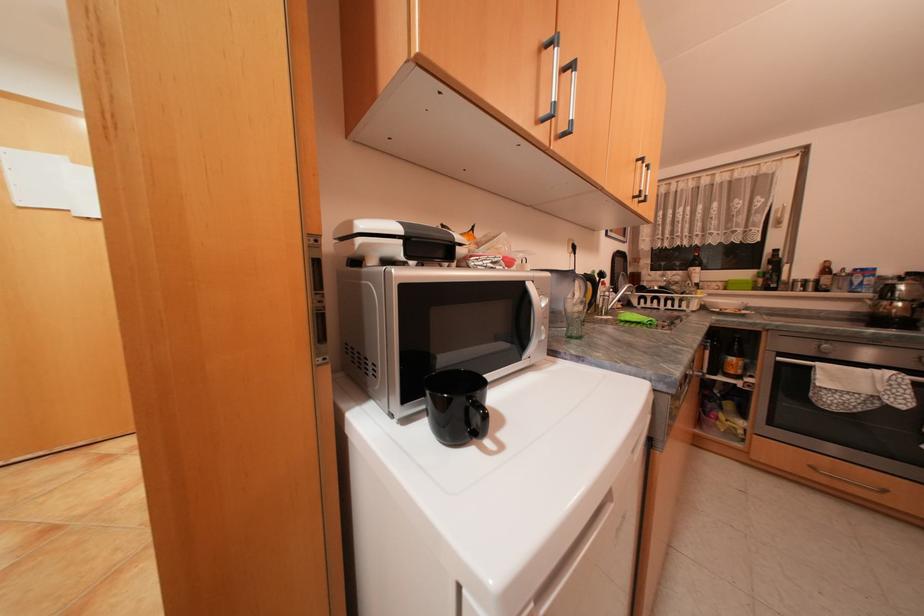
What do you see at coordinates (536, 325) in the screenshot? This screenshot has width=924, height=616. I see `a microwave door handle` at bounding box center [536, 325].